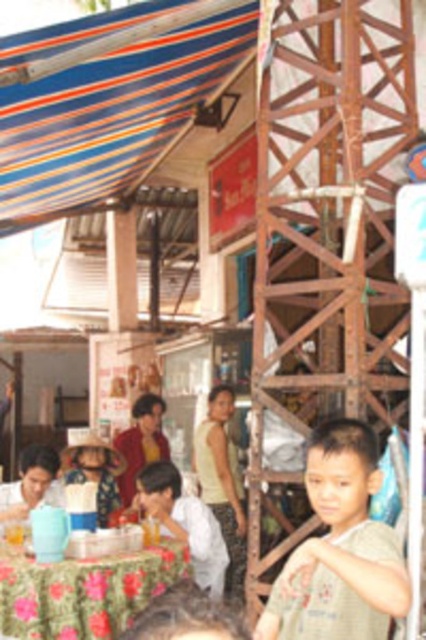
Which is below, floral fabric table at lower left or white cotton shirt at lower center?

floral fabric table at lower left is lower down.

Can you confirm if floral fabric table at lower left is positioned above white cotton shirt at lower center?

Incorrect, floral fabric table at lower left is not positioned above white cotton shirt at lower center.

This screenshot has width=426, height=640. What do you see at coordinates (85, 592) in the screenshot?
I see `floral fabric table at lower left` at bounding box center [85, 592].

Locate an element on the screen. This screenshot has width=426, height=640. floral fabric table at lower left is located at coordinates (85, 592).

From the picture: Does light brown cotton shirt at center have a smaller size compared to floral fabric table at lower left?

Correct, light brown cotton shirt at center occupies less space than floral fabric table at lower left.

Is point (291, 570) farther from viewer compared to point (120, 573)?

No, it is not.

I want to click on light brown cotton shirt at center, so click(x=339, y=548).

Can you confirm if light brown cotton shirt at center is smaller than white cotton shirt at lower center?

Indeed, light brown cotton shirt at center has a smaller size compared to white cotton shirt at lower center.

Is light brown cotton shirt at center bigger than white cotton shirt at lower center?

Actually, light brown cotton shirt at center might be smaller than white cotton shirt at lower center.

Which is in front, point (347, 481) or point (149, 477)?

Point (347, 481) is more forward.

The height and width of the screenshot is (640, 426). In order to click on light brown cotton shirt at center in this screenshot , I will do `click(339, 548)`.